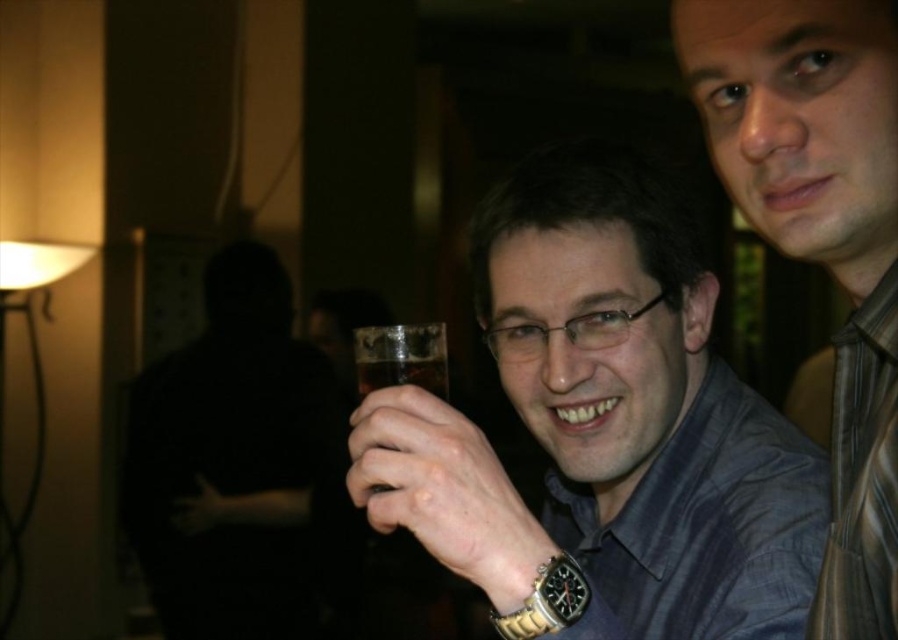
Question: Which object is the farthest from the gold metallic watch at center?

Choices:
 (A) matte glass at center
 (B) clear glass at center
 (C) matte blue shirt at center
 (D) gold metallic watch at lower center

Answer: (C)

Question: Is matte glass at center thinner than gold metallic watch at center?

Choices:
 (A) yes
 (B) no

Answer: (B)

Question: Does matte glass at center appear on the left side of clear glass at center?

Choices:
 (A) yes
 (B) no

Answer: (B)

Question: From the image, what is the correct spatial relationship of clear glass at center in relation to gold metallic watch at lower center?

Choices:
 (A) above
 (B) below

Answer: (A)

Question: Which point is farther to the camera?

Choices:
 (A) (844, 200)
 (B) (548, 572)
 (C) (442, 384)

Answer: (C)

Question: Considering the real-world distances, which object is closest to the matte glass at center?

Choices:
 (A) gold metallic watch at lower center
 (B) clear glass at center
 (C) matte blue shirt at center

Answer: (B)